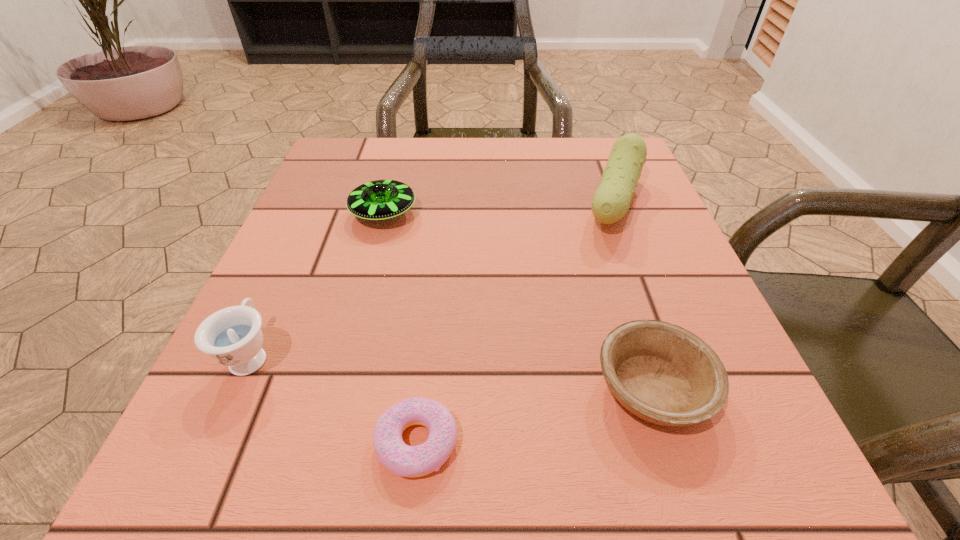
Where is `vacant space located on the left of the bowl`? The image size is (960, 540). vacant space located on the left of the bowl is located at coordinates (355, 388).

You are a GUI agent. You are given a task and a screenshot of the screen. Output one action in this format:
    pyautogui.click(x=<x>, y=<y>)
    Task: Click on the free space located 0.370m on the back of the doughnut
    The image size is (960, 540).
    Given the screenshot: What is the action you would take?
    pyautogui.click(x=440, y=230)

Locate an element on the screen. Image resolution: width=960 pixels, height=540 pixels. object at the far edge is located at coordinates (611, 201).

The width and height of the screenshot is (960, 540). What are the coordinates of `bowl that is positioned at the near edge` in the screenshot? It's located at (662, 373).

Image resolution: width=960 pixels, height=540 pixels. In order to click on doughnut that is positioned at the near edge in this screenshot , I will do `click(401, 459)`.

I want to click on teacup that is at the left edge, so click(x=232, y=336).

Identify the location of saucer that is at the left edge. (378, 200).

What are the coordinates of `cucumber located in the right edge section of the desktop` in the screenshot? It's located at (611, 201).

This screenshot has width=960, height=540. Identify the location of bowl at the right edge. (662, 373).

What are the coordinates of `object that is at the far right corner` in the screenshot? It's located at (611, 201).